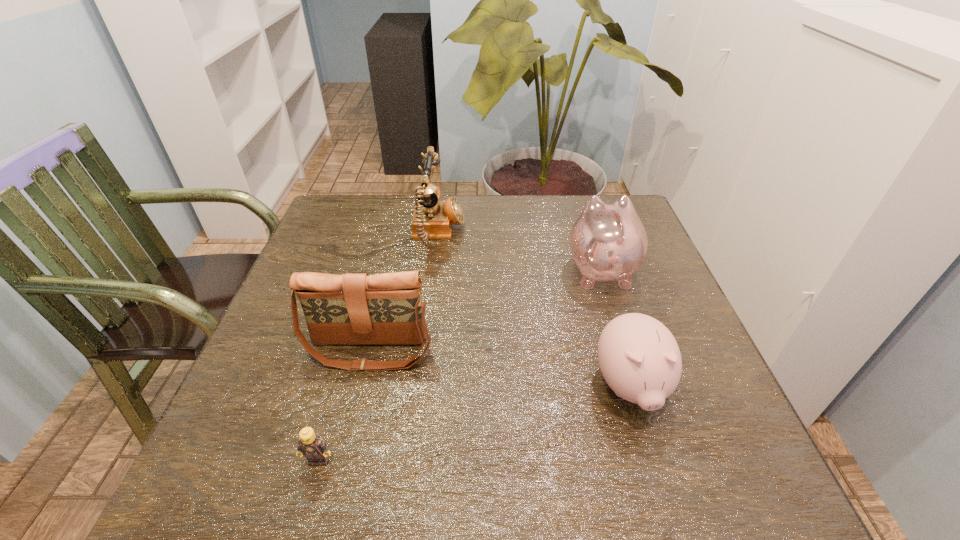
This screenshot has height=540, width=960. In order to click on vacant space that satisfies the following two spatial constraints: 1. on the front facing side of the farther piggy bank; 2. on the dial number of the telephone in this screenshot , I will do `click(589, 233)`.